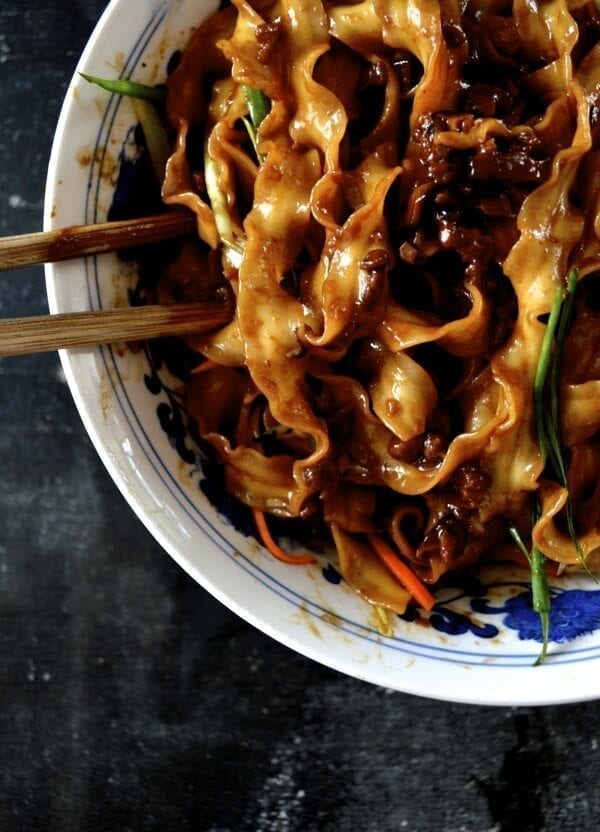
Locate an element on the screen. table is located at coordinates (100, 610).